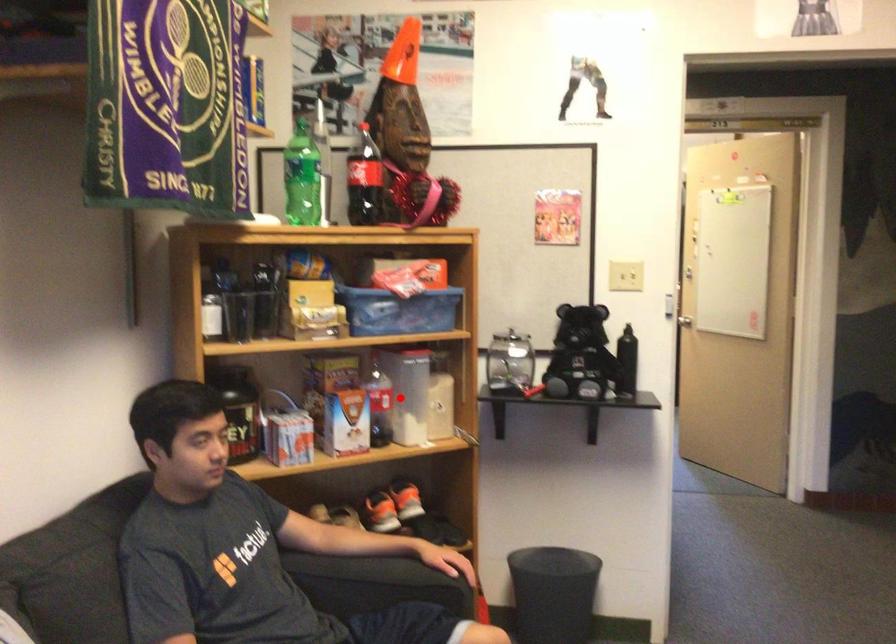
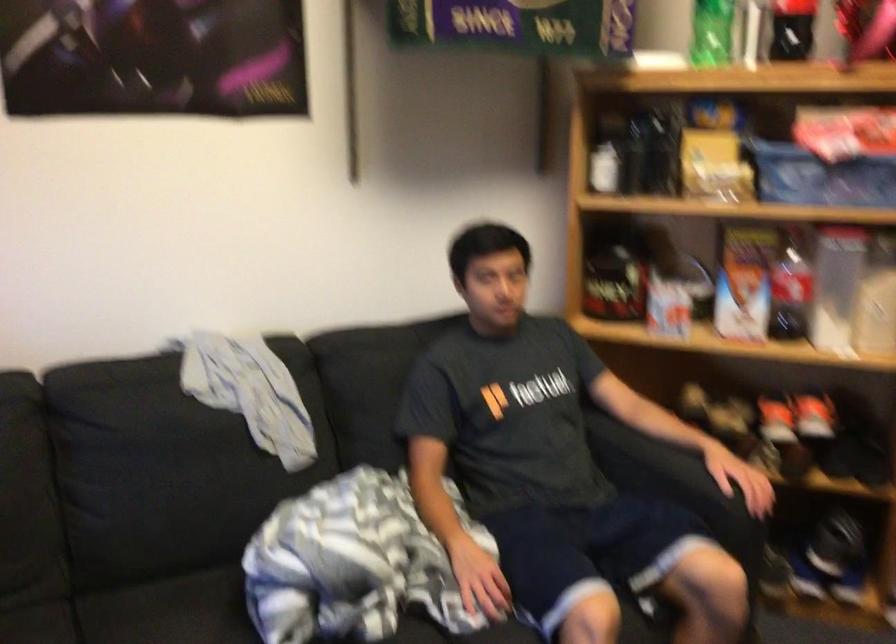
Question: A red point is marked in image1. In image2, is the corresponding 3D point closer to the camera or farther? Reply with the corresponding letter.

Choices:
 (A) The corresponding 3D point is closer.
 (B) The corresponding 3D point is farther.

Answer: (A)